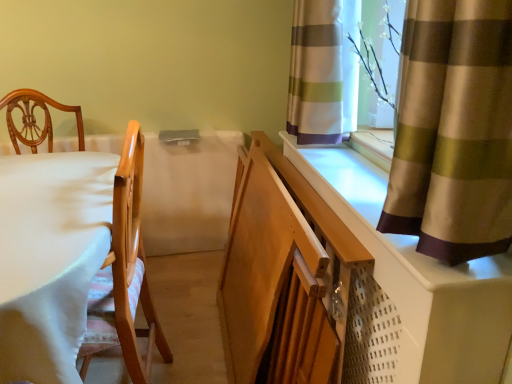
Question: Is white fabric table at left to the left of silky brown curtain at upper right, which is counted as the 1th curtain, starting from the front, from the viewer's perspective?

Choices:
 (A) no
 (B) yes

Answer: (B)

Question: Is white fabric table at left wider than silky brown curtain at upper right, arranged as the second curtain when viewed from the back?

Choices:
 (A) yes
 (B) no

Answer: (A)

Question: Is white fabric table at left shorter than silky brown curtain at upper right, arranged as the second curtain when viewed from the back?

Choices:
 (A) yes
 (B) no

Answer: (B)

Question: Is white fabric table at left bigger than silky brown curtain at upper right, arranged as the second curtain when viewed from the back?

Choices:
 (A) yes
 (B) no

Answer: (A)

Question: From the image's perspective, is white fabric table at left above silky brown curtain at upper right, which is counted as the 1th curtain, starting from the front?

Choices:
 (A) no
 (B) yes

Answer: (A)

Question: Looking at their shapes, would you say white fabric table at left is wider or thinner than silky brown curtain at upper right, which is counted as the 1th curtain, starting from the front?

Choices:
 (A) thin
 (B) wide

Answer: (B)

Question: Is white fabric table at left to the left or to the right of silky brown curtain at upper right, which is counted as the 1th curtain, starting from the front, in the image?

Choices:
 (A) right
 (B) left

Answer: (B)

Question: From a real-world perspective, is white fabric table at left physically located above or below silky brown curtain at upper right, which is counted as the 1th curtain, starting from the front?

Choices:
 (A) below
 (B) above

Answer: (A)

Question: From the image's perspective, is white fabric table at left positioned above or below silky brown curtain at upper right, arranged as the second curtain when viewed from the back?

Choices:
 (A) above
 (B) below

Answer: (B)

Question: From a real-world perspective, is striped fabric curtain at upper right, the first curtain in the back-to-front sequence, above or below white fabric table at left?

Choices:
 (A) above
 (B) below

Answer: (A)

Question: In terms of width, does striped fabric curtain at upper right, the first curtain in the back-to-front sequence, look wider or thinner when compared to white fabric table at left?

Choices:
 (A) thin
 (B) wide

Answer: (A)

Question: Would you say striped fabric curtain at upper right, the first curtain in the back-to-front sequence, is to the left or to the right of white fabric table at left in the picture?

Choices:
 (A) left
 (B) right

Answer: (B)

Question: From the image's perspective, is striped fabric curtain at upper right, the 2th curtain in the front-to-back sequence, positioned above or below white fabric table at left?

Choices:
 (A) below
 (B) above

Answer: (B)

Question: In terms of size, does striped fabric curtain at upper right, the first curtain in the back-to-front sequence, appear bigger or smaller than silky brown curtain at upper right, which is counted as the 1th curtain, starting from the front?

Choices:
 (A) small
 (B) big

Answer: (A)

Question: Is striped fabric curtain at upper right, the first curtain in the back-to-front sequence, inside or outside of silky brown curtain at upper right, arranged as the second curtain when viewed from the back?

Choices:
 (A) outside
 (B) inside

Answer: (A)